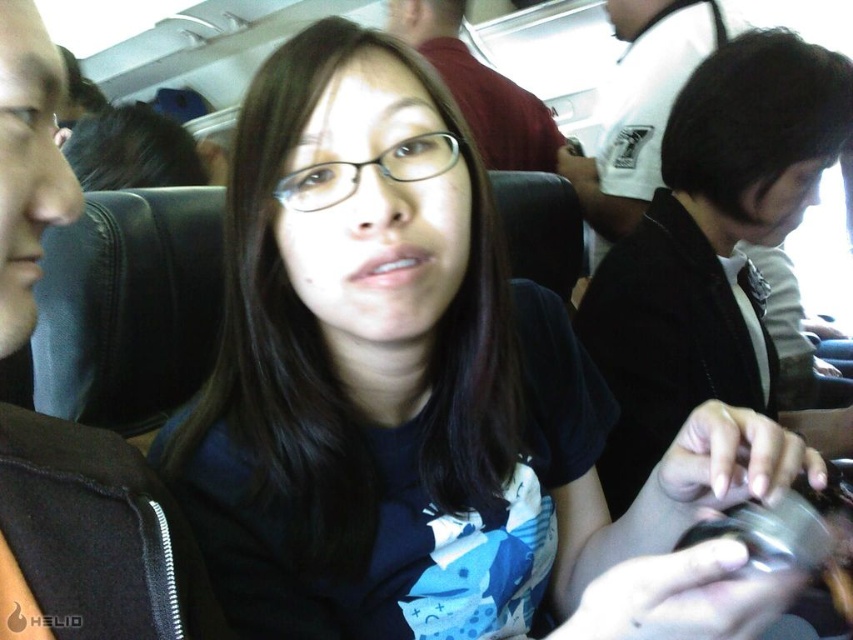
Is black fabric jacket at left to the left of metallic silver cup at lower right from the viewer's perspective?

Yes, black fabric jacket at left is to the left of metallic silver cup at lower right.

Where is `black fabric jacket at left`? The height and width of the screenshot is (640, 853). black fabric jacket at left is located at coordinates (91, 540).

Where is `black fabric jacket at left`? The image size is (853, 640). black fabric jacket at left is located at coordinates (91, 540).

Between black fabric jacket at left and black matte jacket at right, which one appears on the left side from the viewer's perspective?

From the viewer's perspective, black fabric jacket at left appears more on the left side.

The width and height of the screenshot is (853, 640). Describe the element at coordinates (91, 540) in the screenshot. I see `black fabric jacket at left` at that location.

Find the location of a particular element. black fabric jacket at left is located at coordinates (91, 540).

Which is more to the left, maroon shirt at upper center or metallic silver cup at lower right?

maroon shirt at upper center

Image resolution: width=853 pixels, height=640 pixels. In order to click on maroon shirt at upper center in this screenshot , I will do `click(479, 88)`.

Identify the location of maroon shirt at upper center. The height and width of the screenshot is (640, 853). (479, 88).